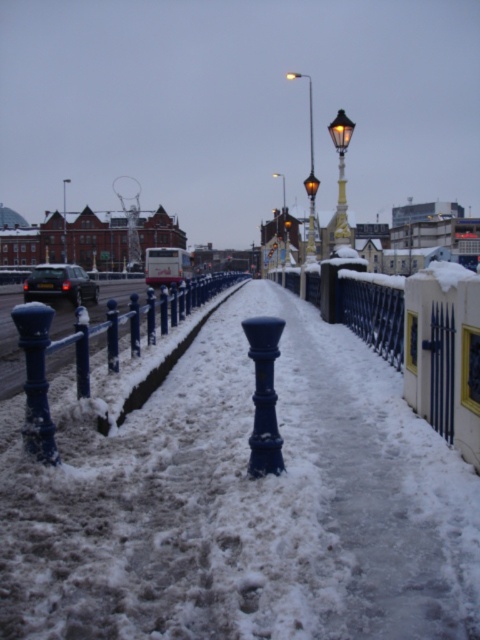
You are navigating a delivery drone that must avoid obstacles. The drone is currently at the origin point. The matte black lamp post at upper center is at coordinates 0.277, 0.644. Can the drone safely fly directly to the destination at coordinates 0.8, 0.8 without passing through the lamp post?

The matte black lamp post at upper center is located at point (309, 177). Since the destination coordinates are (384, 512), the drone can safely fly directly to the destination as the lamp post is not on the path between the origin and the destination.

You need to place a decorative item that is 1 meter wide between the blue painted metal rail at center and the matte black lamp post at upper center. Based on their widths, will the space between them accommodate the item?

The blue painted metal rail at center is narrower than the matte black lamp post at upper center. However, the width of the objects themselves doesn not determine the space between them. The question requires information about the distance between the two objects, not their widths. Since the provided description only states their relative widths, it is impossible to determine if the space between them can fit the 1 meter wide item.

You are standing at the camera position and want to reach the point marked at coordinates (226, 275) in the image. How far will you have to walk to get there?

The point marked at coordinates (226, 275) is 39.65 meters away from the camera, so you will have to walk approximately 39.65 meters to reach it.